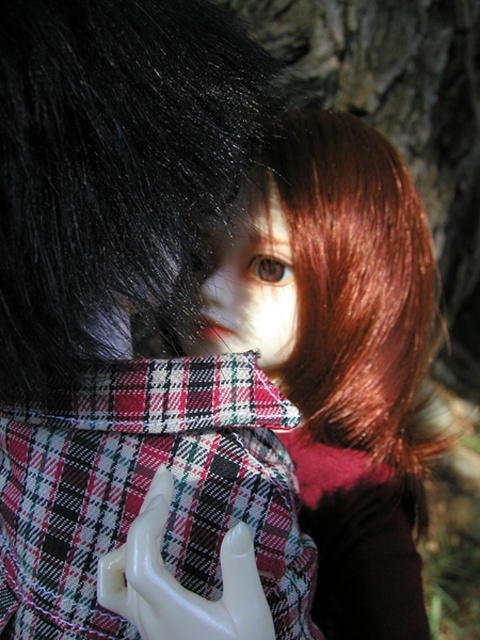
Question: Which point is farther to the camera?

Choices:
 (A) plaid fabric at center
 (B) black shiny hair at upper center
 (C) white glossy hand at center

Answer: (A)

Question: Which point is closer to the camera?

Choices:
 (A) white glossy hand at center
 (B) plaid fabric at center

Answer: (A)

Question: Can you confirm if black shiny hair at upper center is positioned below white glossy hand at center?

Choices:
 (A) yes
 (B) no

Answer: (B)

Question: Is plaid fabric at center bigger than white glossy hand at center?

Choices:
 (A) yes
 (B) no

Answer: (A)

Question: Among these points, which one is nearest to the camera?

Choices:
 (A) (78, 401)
 (B) (148, 637)

Answer: (B)

Question: Can you confirm if black shiny hair at upper center is positioned below plaid fabric at center?

Choices:
 (A) no
 (B) yes

Answer: (A)